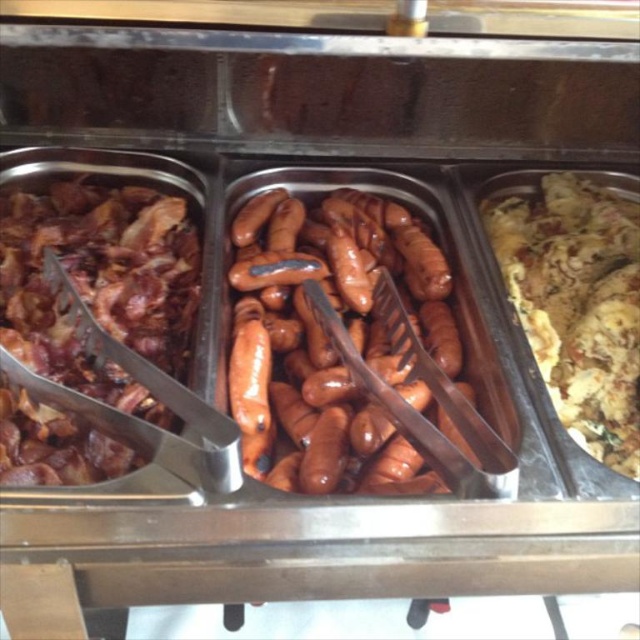
Between glossy brown sausages at center and yellow crumbly at right, which one appears on the right side from the viewer's perspective?

Positioned to the right is yellow crumbly at right.

Where is `glossy brown sausages at center`? The image size is (640, 640). glossy brown sausages at center is located at coordinates (336, 342).

Identify the location of glossy brown sausages at center. (336, 342).

Which is more to the left, glossy brown sausages at center or shiny brown bacon at left?

shiny brown bacon at left is more to the left.

Who is lower down, glossy brown sausages at center or shiny brown bacon at left?

glossy brown sausages at center is lower down.

Find the location of a particular element. glossy brown sausages at center is located at coordinates (336, 342).

Which is in front, point (48, 230) or point (557, 390)?

Positioned in front is point (557, 390).

Is shiny brown bacon at left thinner than yellow crumbly at right?

No.

This screenshot has height=640, width=640. What do you see at coordinates (100, 284) in the screenshot? I see `shiny brown bacon at left` at bounding box center [100, 284].

At what (x,y) coordinates should I click in order to perform the action: click on shiny brown bacon at left. Please return your answer as a coordinate pair (x, y). Looking at the image, I should click on (100, 284).